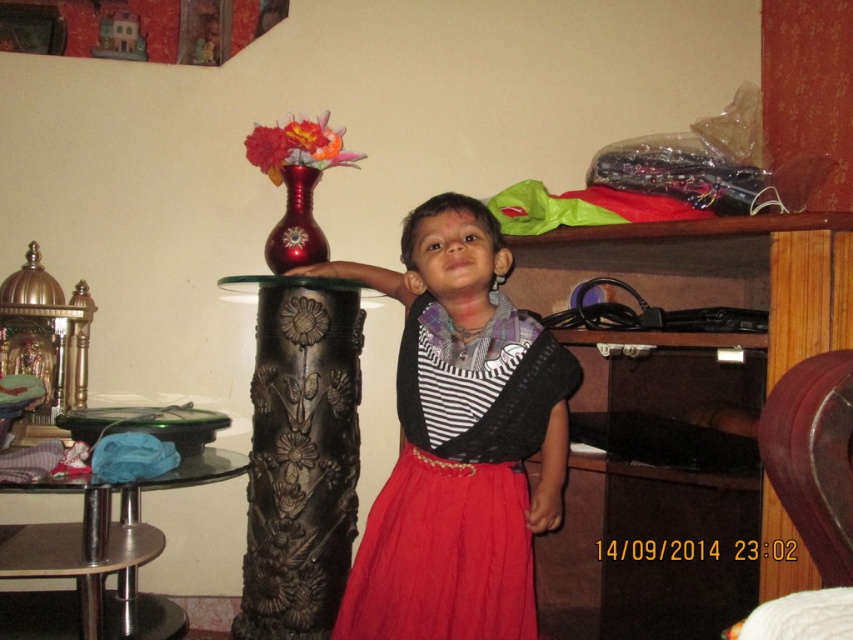
Looking at this image, between shiny red vase at center and matte red vase at upper center, which one has less height?

matte red vase at upper center

Is shiny red vase at center wider than matte red vase at upper center?

Yes.

Does point (276, 256) come in front of point (254, 141)?

No.

The width and height of the screenshot is (853, 640). Identify the location of shiny red vase at center. (296, 225).

Can you confirm if metallic red vase at upper center is thinner than matte red vase at upper center?

No.

Can you confirm if metallic red vase at upper center is bigger than matte red vase at upper center?

Correct, metallic red vase at upper center is larger in size than matte red vase at upper center.

This screenshot has width=853, height=640. What do you see at coordinates (297, 147) in the screenshot?
I see `metallic red vase at upper center` at bounding box center [297, 147].

I want to click on metallic red vase at upper center, so click(297, 147).

Is green glass tray at lower left above matte red vase at upper center?

No, green glass tray at lower left is not above matte red vase at upper center.

Does green glass tray at lower left appear on the left side of matte red vase at upper center?

Yes, green glass tray at lower left is to the left of matte red vase at upper center.

Between point (82, 440) and point (277, 160), which one is positioned behind?

The point (277, 160) is behind.

At what (x,y) coordinates should I click in order to perform the action: click on green glass tray at lower left. Please return your answer as a coordinate pair (x, y). The image size is (853, 640). Looking at the image, I should click on (148, 424).